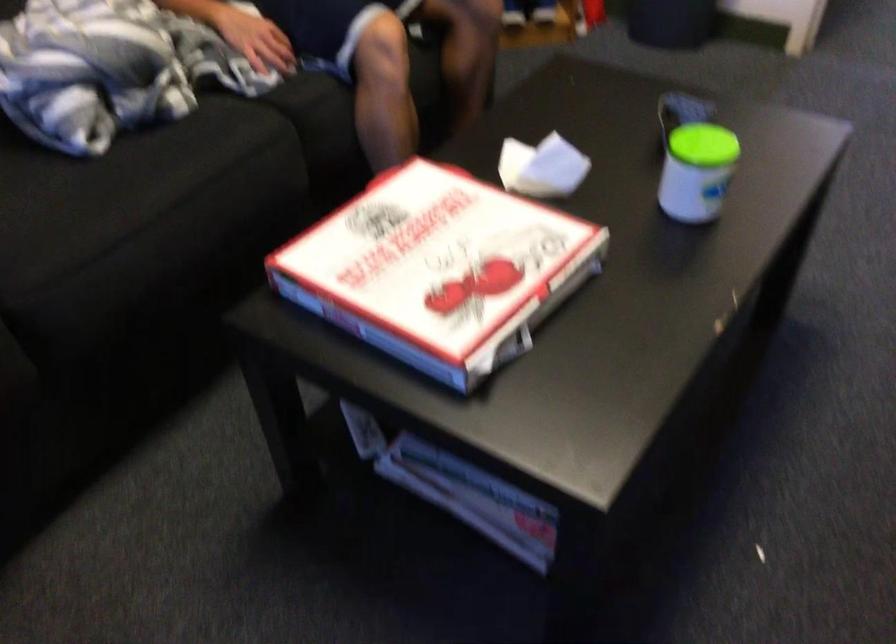
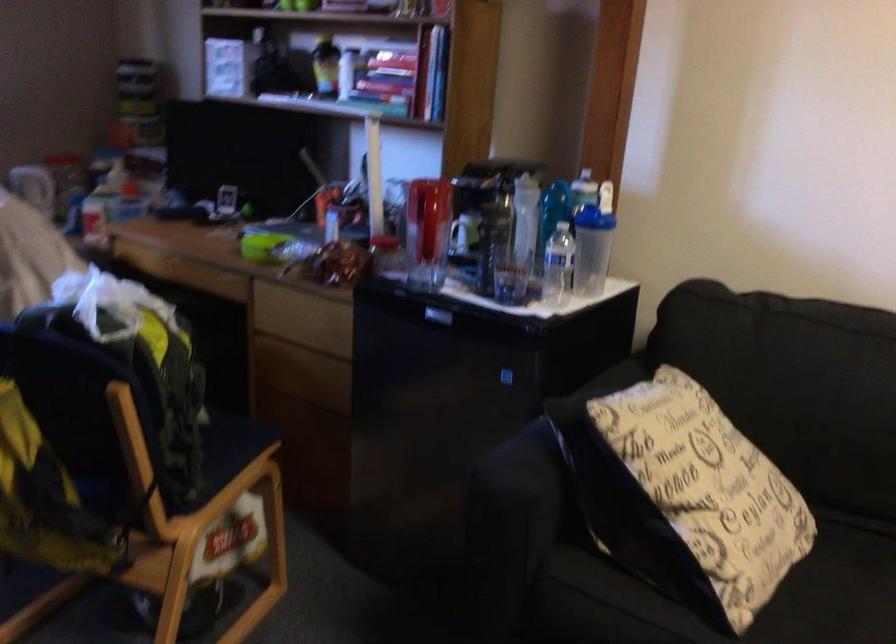
The first image is from the beginning of the video and the second image is from the end. How did the camera likely rotate when shooting the video?

The camera's rotation is toward left-down.